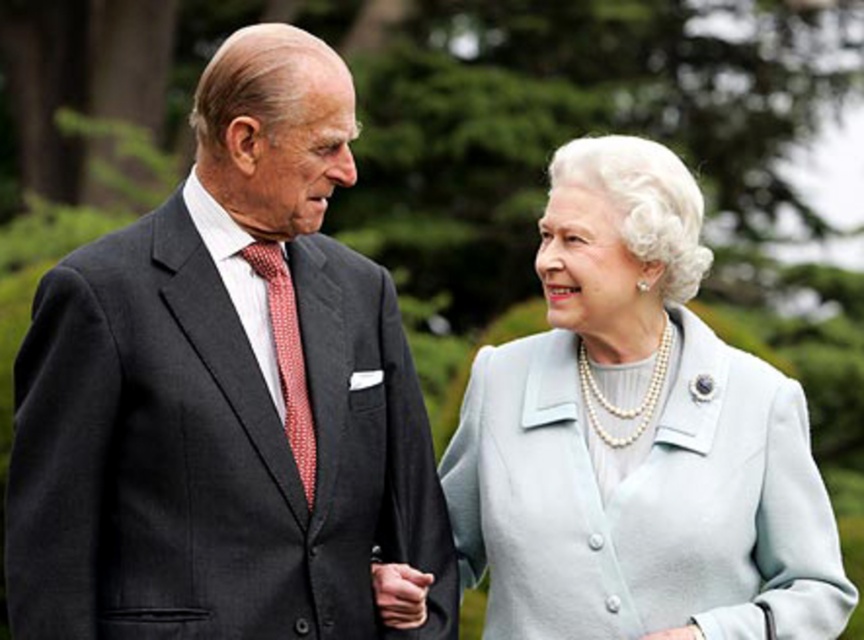
Between dark gray suit at left and light blue fabric coat at center, which one has more height?

dark gray suit at left is taller.

Between dark gray suit at left and light blue fabric coat at center, which one has less height?

Standing shorter between the two is light blue fabric coat at center.

Locate an element on the screen. Image resolution: width=864 pixels, height=640 pixels. dark gray suit at left is located at coordinates (227, 397).

The width and height of the screenshot is (864, 640). In order to click on dark gray suit at left in this screenshot , I will do (x=227, y=397).